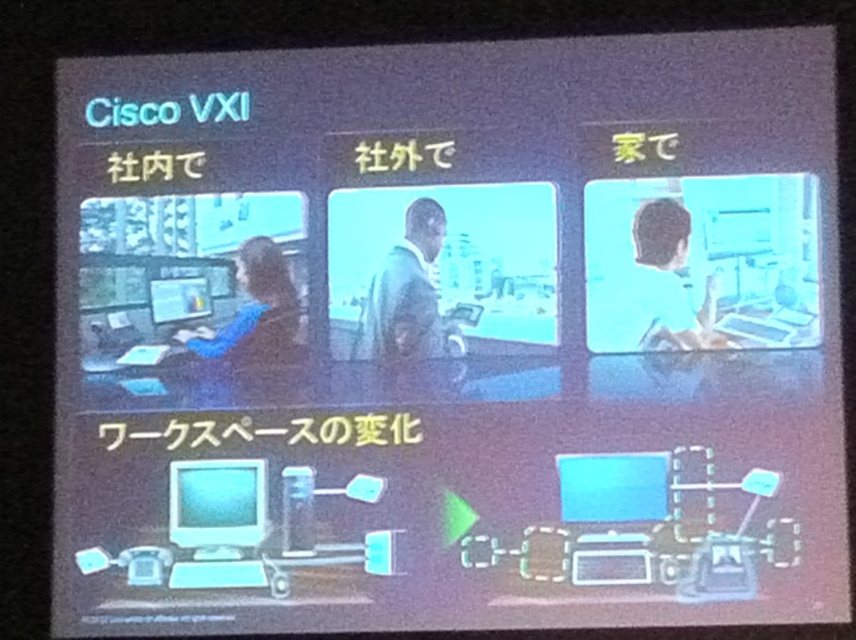
Is white glossy computer monitor at lower left below matte black monitor at center?

Yes.

In the scene shown: Which is more to the left, white glossy computer monitor at lower left or matte black monitor at center?

matte black monitor at center

What do you see at coordinates (217, 502) in the screenshot? I see `white glossy computer monitor at lower left` at bounding box center [217, 502].

I want to click on white glossy computer monitor at lower left, so click(217, 502).

The width and height of the screenshot is (856, 640). What do you see at coordinates (407, 291) in the screenshot?
I see `green matte jacket at center` at bounding box center [407, 291].

Does green matte jacket at center have a greater height compared to white glossy computer monitor at lower left?

Yes.

Who is more forward, (379, 316) or (194, 531)?

Point (194, 531) is more forward.

Find the location of a particular element. Image resolution: width=856 pixels, height=640 pixels. green matte jacket at center is located at coordinates [x=407, y=291].

Consider the image. Who is more distant from viewer, (187, 529) or (254, 339)?

The point (254, 339) is behind.

Does white glossy computer monitor at lower left have a smaller size compared to blue matte shirt at center?

Yes.

Is point (235, 531) in front of point (218, 348)?

Yes.

Identify the location of white glossy computer monitor at lower left. The height and width of the screenshot is (640, 856). (217, 502).